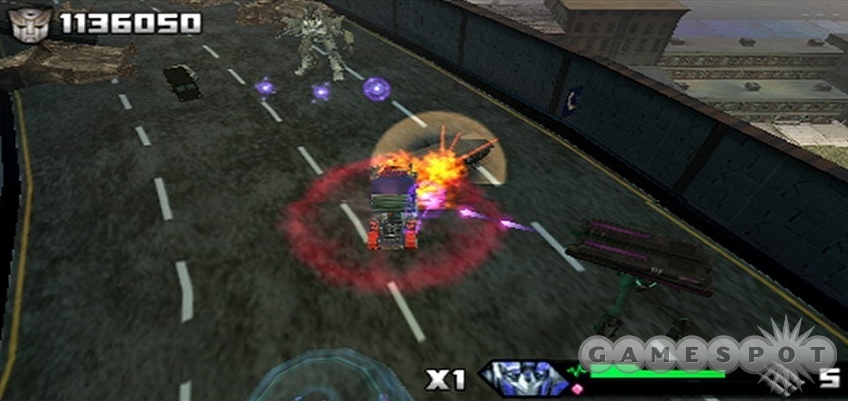
This screenshot has height=401, width=848. In order to click on non round purple light in this screenshot , I will do `click(516, 224)`, `click(477, 216)`, `click(431, 202)`.